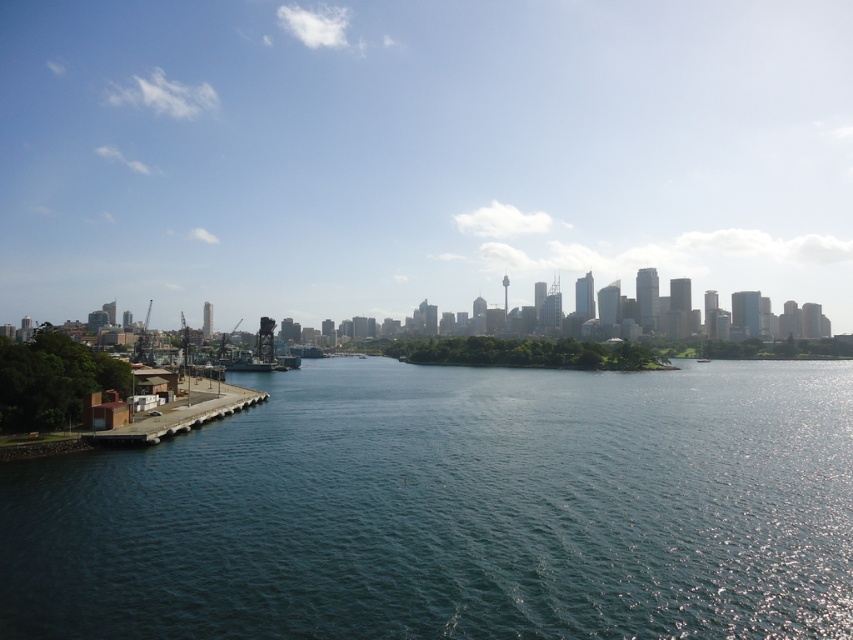
You are a photographer planning to capture the transparent glass skyline at upper center and the brown concrete dock at lower left in a single shot. Which object will appear taller in your photograph?

The transparent glass skyline at upper center will appear taller in the photograph because it has a greater height compared to the brown concrete dock at lower left.

You are a photographer planning to capture the entire city skyline in one shot. You notice the dark blue water at center and the brown concrete dock at lower left. Which object takes up more horizontal space in the image?

The dark blue water at center takes up more horizontal space than the brown concrete dock at lower left because its width surpasses the dock.